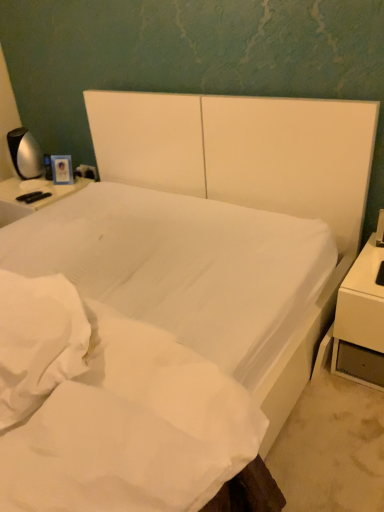
Question: Considering the positions of point (81, 416) and point (359, 332), is point (81, 416) closer or farther from the camera than point (359, 332)?

Choices:
 (A) farther
 (B) closer

Answer: (B)

Question: Considering the positions of white smooth mattress at center and white glossy nightstand at right in the image, is white smooth mattress at center wider or thinner than white glossy nightstand at right?

Choices:
 (A) thin
 (B) wide

Answer: (B)

Question: Estimate the real-world distances between objects in this image. Which object is closer to the satin silver lamp at left?

Choices:
 (A) white smooth mattress at center
 (B) white glossy nightstand at right

Answer: (A)

Question: Based on their relative distances, which object is nearer to the white smooth mattress at center?

Choices:
 (A) satin silver lamp at left
 (B) white glossy nightstand at right

Answer: (B)